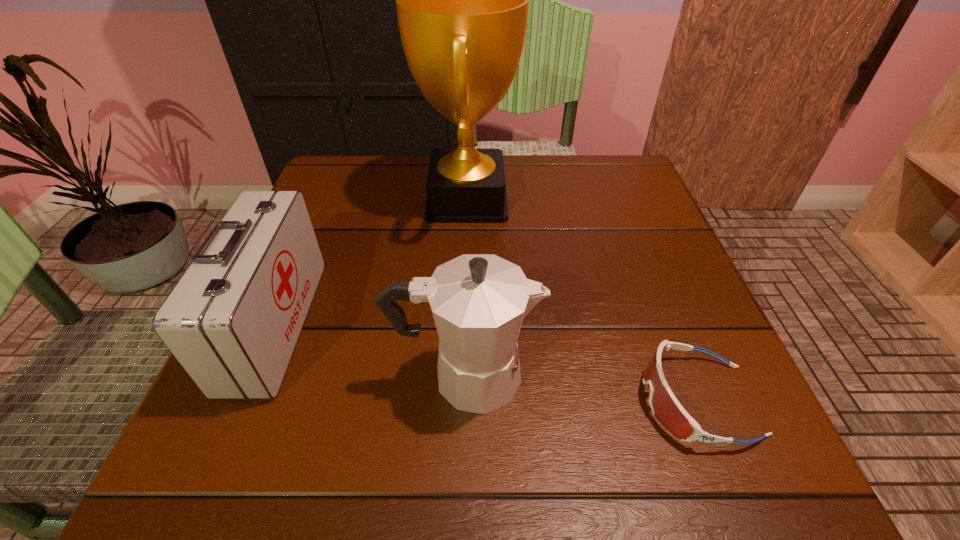
Locate an element on the screen. The width and height of the screenshot is (960, 540). the tallest object is located at coordinates (462, 0).

Identify the location of the farthest object. The height and width of the screenshot is (540, 960). (462, 0).

Where is `the third shortest object`? The height and width of the screenshot is (540, 960). the third shortest object is located at coordinates (478, 301).

The width and height of the screenshot is (960, 540). I want to click on the leftmost object, so click(232, 321).

The image size is (960, 540). I want to click on the third tallest object, so click(232, 321).

You are a GUI agent. You are given a task and a screenshot of the screen. Output one action in this format:
    pyautogui.click(x=<x>, y=<y>)
    Task: Click on the shortest object
    The width and height of the screenshot is (960, 540).
    Given the screenshot: What is the action you would take?
    pyautogui.click(x=665, y=406)

The width and height of the screenshot is (960, 540). I want to click on goggles, so click(x=665, y=406).

You are a GUI agent. You are given a task and a screenshot of the screen. Output one action in this format:
    pyautogui.click(x=<x>, y=<y>)
    Task: Click on the free location located 0.100m on the front-facing side of the farthest object
    The height and width of the screenshot is (540, 960).
    Given the screenshot: What is the action you would take?
    pyautogui.click(x=559, y=199)

You are a GUI agent. You are given a task and a screenshot of the screen. Output one action in this format:
    pyautogui.click(x=<x>, y=<y>)
    Task: Click on the vacant space situated 0.270m at the spout of the coffeepot
    
    Given the screenshot: What is the action you would take?
    pyautogui.click(x=712, y=376)

The width and height of the screenshot is (960, 540). What are the coordinates of `vacant space located on the front-facing side of the third tallest object` in the screenshot? It's located at (491, 325).